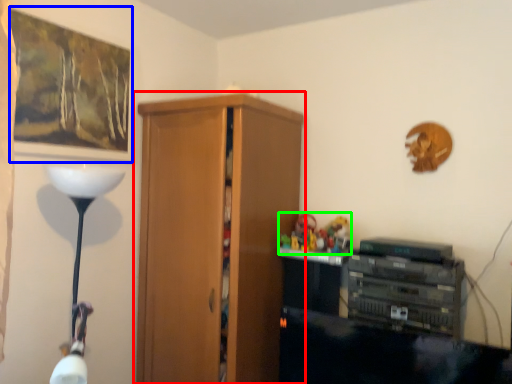
Question: Which object is positioned closest to cupboard (highlighted by a red box)? Select from picture frame (highlighted by a blue box) and toy (highlighted by a green box).

Choices:
 (A) picture frame
 (B) toy

Answer: (B)